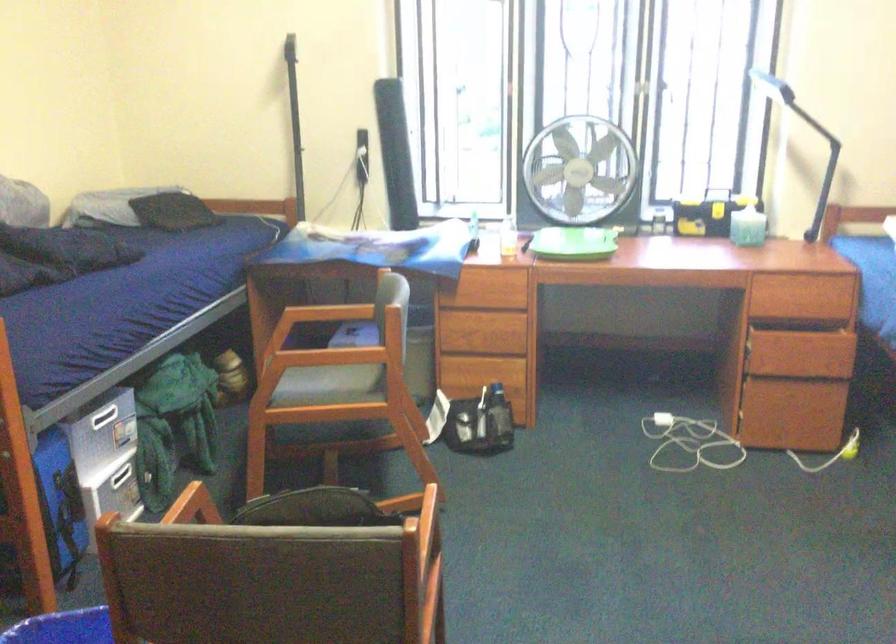
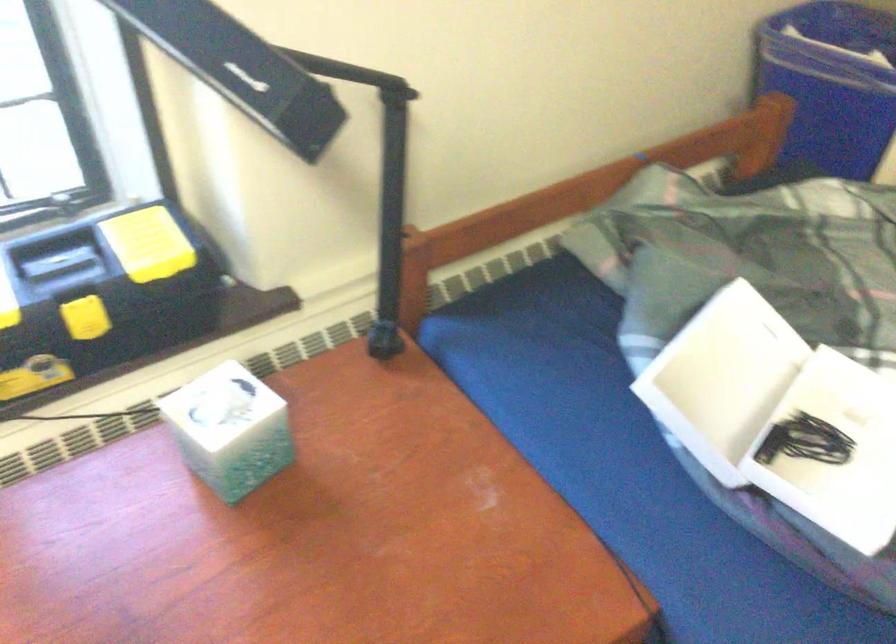
Locate, in the second image, the point that corresponds to point 755,207 in the first image.

(229, 430)